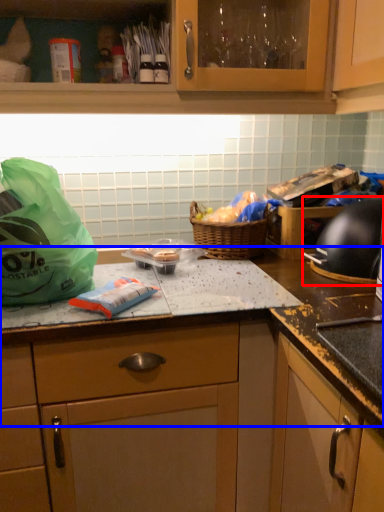
Question: Among these objects, which one is farthest to the camera, gas stove (highlighted by a red box) or countertop (highlighted by a blue box)?

Choices:
 (A) gas stove
 (B) countertop

Answer: (A)